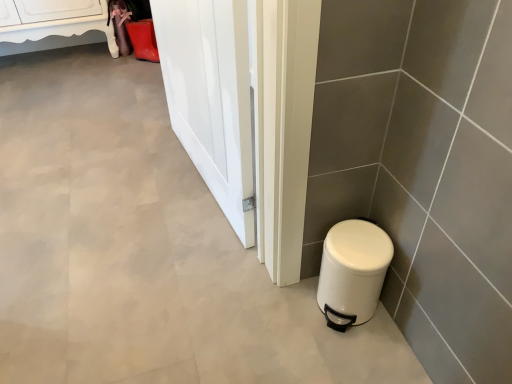
The height and width of the screenshot is (384, 512). In order to click on free space in front of white matte trash can at lower right in this screenshot , I will do `click(357, 354)`.